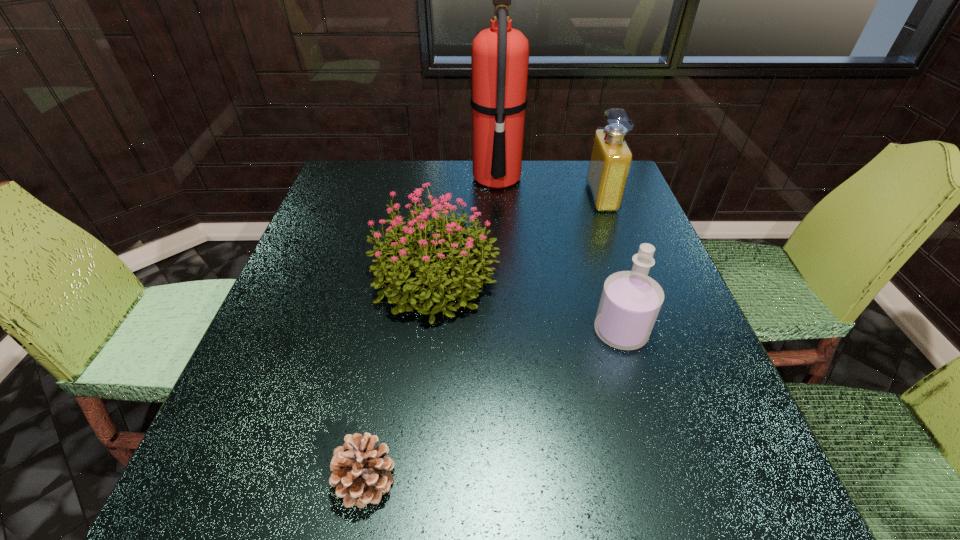
Where is `vacant area that lies between the nearest object and the farther perfume`? This screenshot has height=540, width=960. vacant area that lies between the nearest object and the farther perfume is located at coordinates (484, 339).

Where is `empty space that is in between the nearest object and the bouquet`? empty space that is in between the nearest object and the bouquet is located at coordinates (400, 379).

This screenshot has height=540, width=960. Identify the location of vacant space that's between the nearer perfume and the bouquet. (528, 305).

The width and height of the screenshot is (960, 540). Find the location of `free space that is in between the bouquet and the nearer perfume`. free space that is in between the bouquet and the nearer perfume is located at coordinates (528, 305).

Identify which object is the closest to the bouquet. Please provide its 2D coordinates. Your answer should be formatted as a tuple, i.e. [(x, y)], where the tuple contains the x and y coordinates of a point satisfying the conditions above.

[(500, 54)]

This screenshot has width=960, height=540. Identify the location of the third closest object to the nearer perfume. (361, 473).

At what (x,y) coordinates should I click in order to perform the action: click on vacant position in the image that satisfies the following two spatial constraints: 1. at the nozzle of the fire extinguisher; 2. on the right side of the nearer perfume. Please return your answer as a coordinate pair (x, y). Looking at the image, I should click on (505, 332).

In order to click on free space in the image that satisfies the following two spatial constraints: 1. on the back side of the nearer perfume; 2. on the left side of the pinecone in this screenshot , I will do `click(394, 332)`.

Where is `blank space that satisfies the following two spatial constraints: 1. at the nozzle of the nearer perfume; 2. on the left side of the tallest object`? The image size is (960, 540). blank space that satisfies the following two spatial constraints: 1. at the nozzle of the nearer perfume; 2. on the left side of the tallest object is located at coordinates (505, 332).